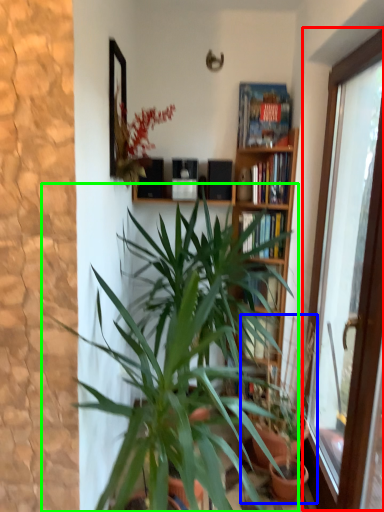
Question: Estimate the real-world distances between objects in this image. Which object is farther from window (highlighted by a red box), houseplant (highlighted by a blue box) or houseplant (highlighted by a green box)?

Choices:
 (A) houseplant
 (B) houseplant

Answer: (B)